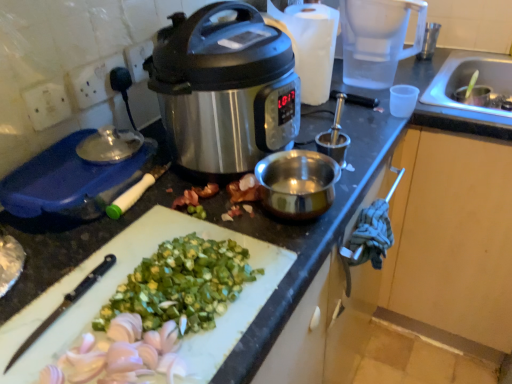
Question: Are transparent plastic blender at upper right and stainless steel slow cooker at center located far from each other?

Choices:
 (A) no
 (B) yes

Answer: (A)

Question: Considering the relative sizes of transparent plastic blender at upper right and stainless steel slow cooker at center in the image provided, is transparent plastic blender at upper right taller than stainless steel slow cooker at center?

Choices:
 (A) yes
 (B) no

Answer: (B)

Question: Is stainless steel slow cooker at center surrounded by transparent plastic blender at upper right?

Choices:
 (A) no
 (B) yes

Answer: (A)

Question: Considering the relative sizes of transparent plastic blender at upper right and stainless steel slow cooker at center in the image provided, is transparent plastic blender at upper right shorter than stainless steel slow cooker at center?

Choices:
 (A) no
 (B) yes

Answer: (B)

Question: Could you tell me if transparent plastic blender at upper right is turned towards stainless steel slow cooker at center?

Choices:
 (A) no
 (B) yes

Answer: (A)

Question: Is the depth of transparent plastic blender at upper right greater than that of stainless steel slow cooker at center?

Choices:
 (A) no
 (B) yes

Answer: (B)

Question: Is stainless steel slow cooker at center to the left of white plastic cutting board at lower center from the viewer's perspective?

Choices:
 (A) no
 (B) yes

Answer: (A)

Question: Could you tell me if stainless steel slow cooker at center is turned towards white plastic cutting board at lower center?

Choices:
 (A) yes
 (B) no

Answer: (B)

Question: From a real-world perspective, is stainless steel slow cooker at center beneath white plastic cutting board at lower center?

Choices:
 (A) yes
 (B) no

Answer: (B)

Question: Can you confirm if stainless steel slow cooker at center is taller than white plastic cutting board at lower center?

Choices:
 (A) no
 (B) yes

Answer: (B)

Question: Is stainless steel slow cooker at center positioned beyond the bounds of white plastic cutting board at lower center?

Choices:
 (A) no
 (B) yes

Answer: (B)

Question: From a real-world perspective, is stainless steel slow cooker at center physically above white plastic cutting board at lower center?

Choices:
 (A) no
 (B) yes

Answer: (B)

Question: From a real-world perspective, is blue plastic container at left below metallic silver cup at upper right?

Choices:
 (A) no
 (B) yes

Answer: (B)